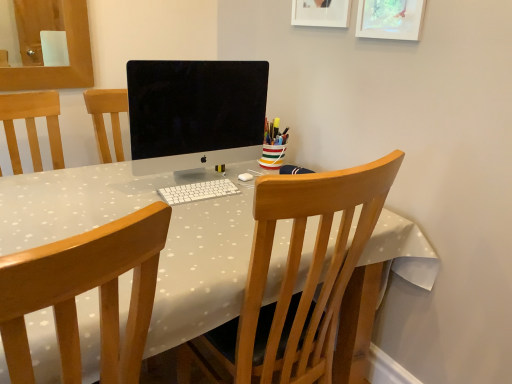
Question: Is wooden chair at center, the first chair viewed from the right, outside of wooden chair at center, the second chair when ordered from right to left?

Choices:
 (A) yes
 (B) no

Answer: (A)

Question: From a real-world perspective, is wooden chair at center, the first chair viewed from the right, on wooden chair at center, positioned as the 1th chair in left-to-right order?

Choices:
 (A) no
 (B) yes

Answer: (A)

Question: Is the position of wooden chair at center, the first chair viewed from the right, more distant than that of wooden chair at center, the second chair when ordered from right to left?

Choices:
 (A) no
 (B) yes

Answer: (B)

Question: Considering the relative positions of wooden chair at center, the first chair viewed from the right, and wooden chair at center, positioned as the 1th chair in left-to-right order, in the image provided, is wooden chair at center, the first chair viewed from the right, to the right of wooden chair at center, positioned as the 1th chair in left-to-right order, from the viewer's perspective?

Choices:
 (A) yes
 (B) no

Answer: (A)

Question: Is wooden chair at center, the 2th chair positioned from the left, positioned far away from wooden chair at center, the second chair when ordered from right to left?

Choices:
 (A) yes
 (B) no

Answer: (B)

Question: From the image's perspective, is striped ceramic cup at center positioned above or below white plastic keyboard at center?

Choices:
 (A) above
 (B) below

Answer: (A)

Question: Considering the relative positions of striped ceramic cup at center and white plastic keyboard at center in the image provided, is striped ceramic cup at center to the left or to the right of white plastic keyboard at center?

Choices:
 (A) left
 (B) right

Answer: (B)

Question: Does point (280, 162) appear closer or farther from the camera than point (184, 187)?

Choices:
 (A) farther
 (B) closer

Answer: (A)

Question: Based on their sizes in the image, would you say striped ceramic cup at center is bigger or smaller than white plastic keyboard at center?

Choices:
 (A) big
 (B) small

Answer: (A)

Question: Considering the positions of point (328, 26) and point (202, 193), is point (328, 26) closer or farther from the camera than point (202, 193)?

Choices:
 (A) farther
 (B) closer

Answer: (A)

Question: Considering the positions of white matte picture frame at upper center, the second picture frame positioned from the right, and white plastic keyboard at center in the image, is white matte picture frame at upper center, the second picture frame positioned from the right, bigger or smaller than white plastic keyboard at center?

Choices:
 (A) small
 (B) big

Answer: (B)

Question: In the image, is white matte picture frame at upper center, the second picture frame positioned from the right, on the left side or the right side of white plastic keyboard at center?

Choices:
 (A) left
 (B) right

Answer: (B)

Question: Do you think white matte picture frame at upper center, arranged as the 1th picture frame when viewed from the left, is within white plastic keyboard at center, or outside of it?

Choices:
 (A) inside
 (B) outside

Answer: (B)

Question: From a real-world perspective, is wooden chair at center, the 2th chair positioned from the left, positioned above or below striped ceramic cup at center?

Choices:
 (A) below
 (B) above

Answer: (A)

Question: Considering the positions of wooden chair at center, the 2th chair positioned from the left, and striped ceramic cup at center in the image, is wooden chair at center, the 2th chair positioned from the left, taller or shorter than striped ceramic cup at center?

Choices:
 (A) tall
 (B) short

Answer: (A)